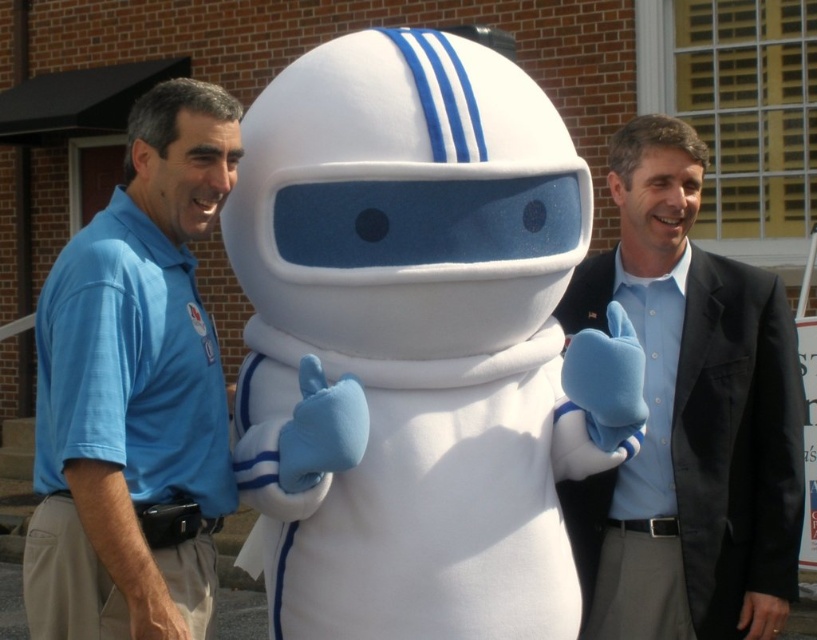
Consider the image. You are standing in front of the brick building and want to take a photo of the point at coordinates point (230, 474). If your camera has a focal length of 50mm and you are 3.73 meters away from the point, what is the angle of view required to capture the point in the center of the photo?

The point (230, 474) is 3.73 meters away from the viewer. To calculate the angle of view needed, use the formula angle of view in radians equals arctangent of half the sensor width divided by focal length multiplied by distance. However, without sensor size details, an exact angle can be estimated using standard 35mm sensor dimensions. For a 35mm sensor, the angle of view would be approximately 46 degrees, allowing the point to be centered in the photo.

From the picture: You are a photographer trying to capture a group photo of the blue cotton shirt at left and light blue shirt at right. To ensure both are visible in the frame, which side should you position yourself relative to the subjects?

You should position yourself to the right of the subjects so that both the blue cotton shirt at left and light blue shirt at right are visible in the frame. Since the blue cotton shirt at left is to the left of the light blue shirt at right, standing to the right allows you to see both without one blocking the other.